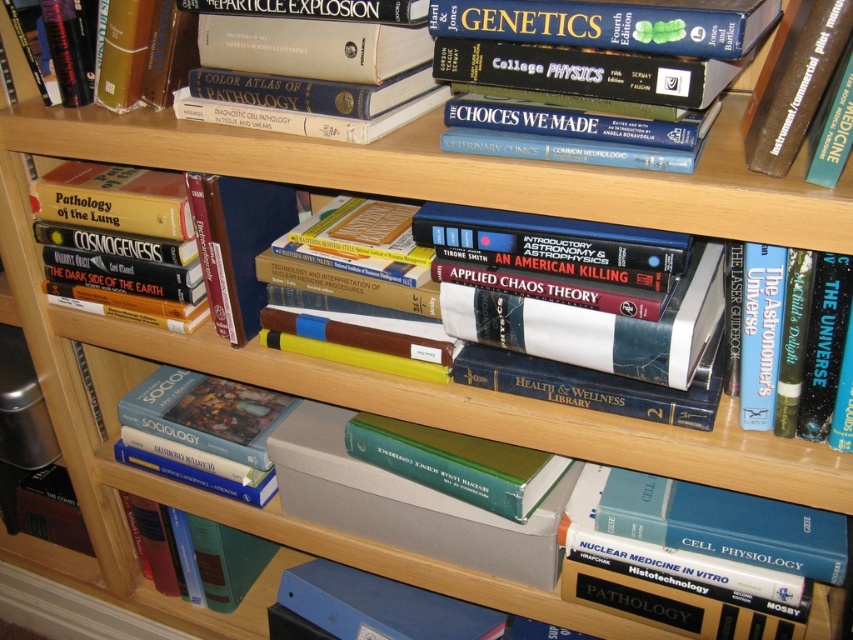
Question: Which of the following is the closest to the observer?

Choices:
 (A) (33, 122)
 (B) (780, 417)
 (C) (842, 336)
 (D) (160, 564)

Answer: (C)

Question: Based on their relative distances, which object is nearer to the hardcover book at center?

Choices:
 (A) hardcover book at upper right
 (B) blue hardcover book at right
 (C) hardcover book at lower left
 (D) hardcover book at upper center

Answer: (D)

Question: Is hardcover book at center above blue hardcover book at right?

Choices:
 (A) yes
 (B) no

Answer: (A)

Question: Does blue hardcover book at right appear on the left side of hardcover book at lower left?

Choices:
 (A) no
 (B) yes

Answer: (A)

Question: Does hardcover book at center appear under hardcover book at lower left?

Choices:
 (A) yes
 (B) no

Answer: (B)

Question: Which object is closer to the camera taking this photo?

Choices:
 (A) hardcover book at lower left
 (B) hardcover book at upper center
 (C) hardcover book at upper right

Answer: (C)